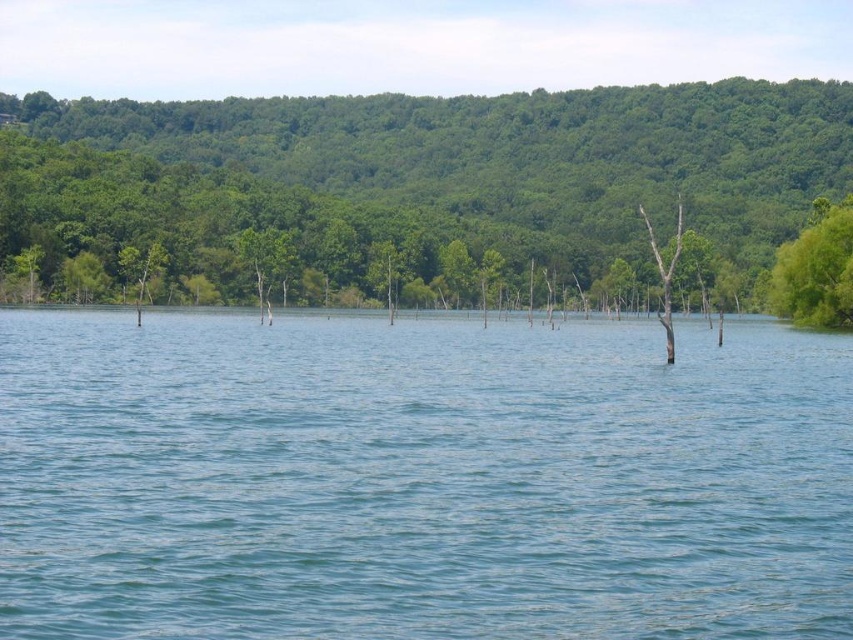
Can you confirm if green leafy tree at upper center is taller than brown wood tree at center?

Yes, green leafy tree at upper center is taller than brown wood tree at center.

Does green leafy tree at upper center have a lesser width compared to brown wood tree at center?

In fact, green leafy tree at upper center might be wider than brown wood tree at center.

Is point (115, 195) positioned after point (662, 284)?

No, (115, 195) is in front of (662, 284).

Identify the location of green leafy tree at upper center. Image resolution: width=853 pixels, height=640 pixels. (418, 192).

Is green leafy tree at right behind brown wood tree at center?

Yes, it is behind brown wood tree at center.

Does point (836, 257) come in front of point (679, 243)?

Yes.

Is point (837, 305) more distant than point (662, 278)?

Yes, it is.

In order to click on green leafy tree at right in this screenshot , I will do `click(816, 269)`.

Between green leafy tree at upper center and green leafy tree at right, which one appears on the right side from the viewer's perspective?

green leafy tree at right is more to the right.

Does green leafy tree at upper center lie in front of green leafy tree at right?

No, green leafy tree at upper center is further to the viewer.

Where is `green leafy tree at upper center`? This screenshot has height=640, width=853. green leafy tree at upper center is located at coordinates (418, 192).